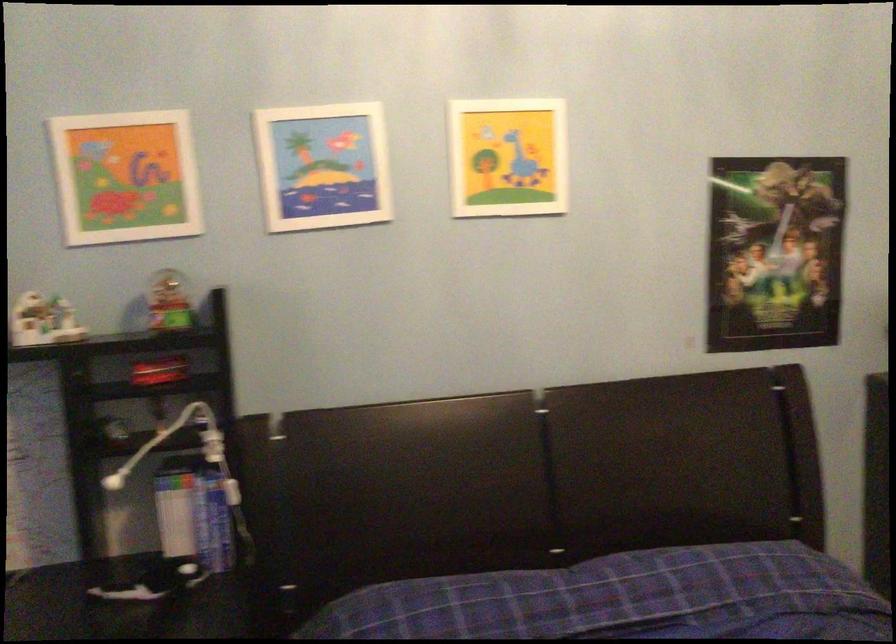
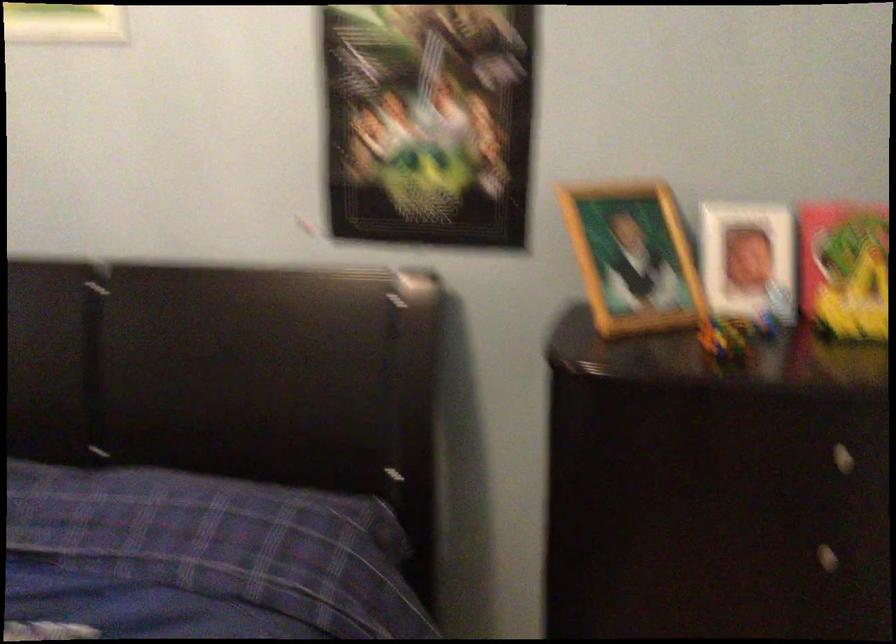
The images are taken continuously from a first-person perspective. In which direction are you moving?

The cameraman walked toward right, forward.